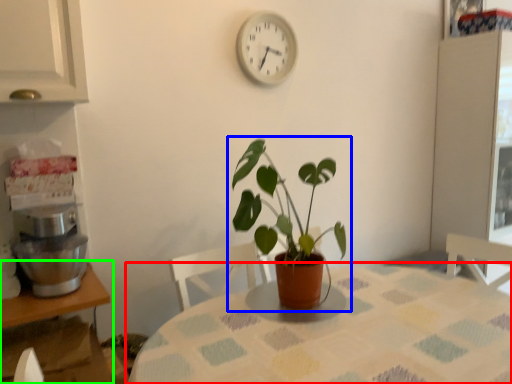
Question: Estimate the real-world distances between objects in this image. Which object is closer to table (highlighted by a red box), houseplant (highlighted by a blue box) or table (highlighted by a green box)?

Choices:
 (A) houseplant
 (B) table

Answer: (A)